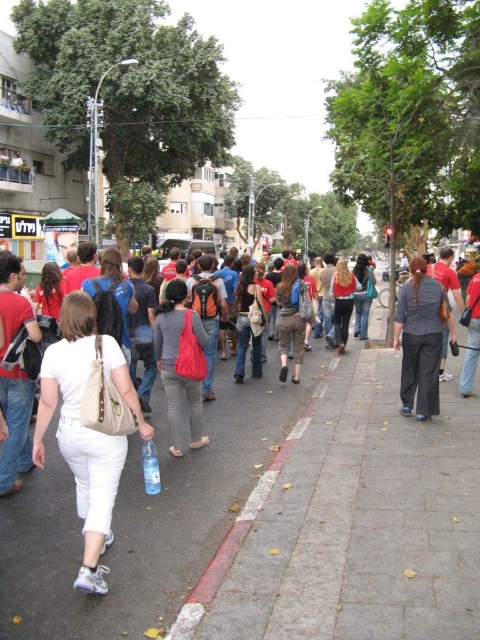
Question: Is white fabric bag at center further to the viewer compared to matte red bag at center?

Choices:
 (A) no
 (B) yes

Answer: (A)

Question: Which object appears farthest from the camera in this image?

Choices:
 (A) white fabric bag at center
 (B) matte red bag at center

Answer: (B)

Question: Among these objects, which one is farthest from the camera?

Choices:
 (A) matte red bag at center
 (B) white fabric bag at center

Answer: (A)

Question: Where is white fabric bag at center located in relation to matte red bag at center in the image?

Choices:
 (A) right
 (B) left

Answer: (B)

Question: Which of the following is the farthest from the observer?

Choices:
 (A) (164, 356)
 (B) (105, 476)

Answer: (A)

Question: Where is white fabric bag at center located in relation to matte red bag at center in the image?

Choices:
 (A) right
 (B) left

Answer: (B)